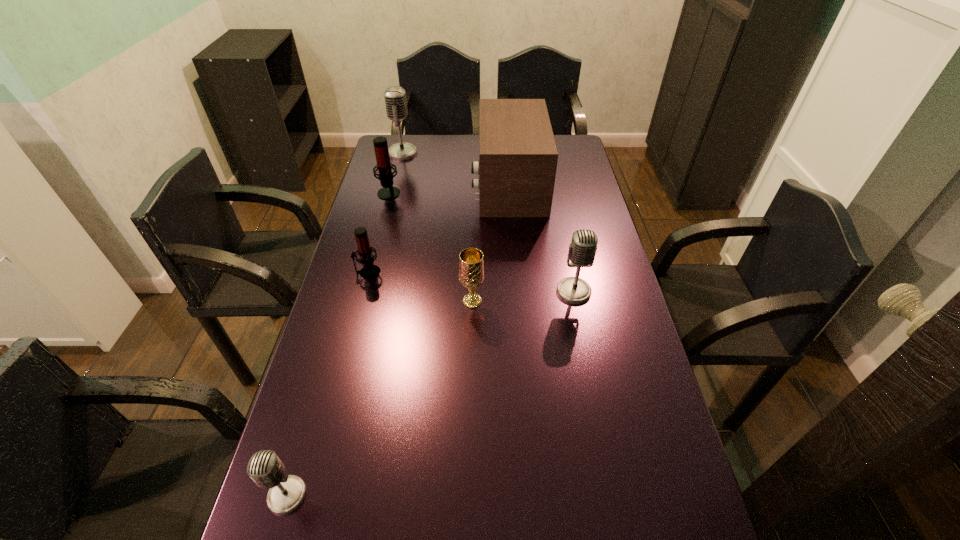
Identify the location of vacant space in between the radio receiver and the smallest gray microphone. (397, 340).

Identify the location of vacant space that is in between the chalice and the nearest object. The image size is (960, 540). (379, 398).

Locate an element on the screen. The image size is (960, 540). empty location between the farthest microphone and the nearest object is located at coordinates (345, 324).

Locate an element on the screen. The width and height of the screenshot is (960, 540). free space between the chalice and the second biggest gray microphone is located at coordinates (523, 296).

At what (x,y) coordinates should I click in order to perform the action: click on blank region between the farther red microphone and the chalice. Please return your answer as a coordinate pair (x, y). The width and height of the screenshot is (960, 540). Looking at the image, I should click on (430, 246).

At what (x,y) coordinates should I click in order to perform the action: click on the third closest object to the radio receiver. Please return your answer as a coordinate pair (x, y). This screenshot has width=960, height=540. Looking at the image, I should click on pos(582,250).

The width and height of the screenshot is (960, 540). In order to click on object that can be found as the sixth closest to the bigger red microphone in this screenshot , I will do `click(287, 492)`.

Where is `microphone that is the third closest to the rightmost gray microphone`? The image size is (960, 540). microphone that is the third closest to the rightmost gray microphone is located at coordinates (287, 492).

Find the location of a particular element. The height and width of the screenshot is (540, 960). microphone that is the second closest to the chalice is located at coordinates (369, 271).

In order to click on gray microphone that is the third closest to the fourth nearest microphone in this screenshot , I will do `click(287, 492)`.